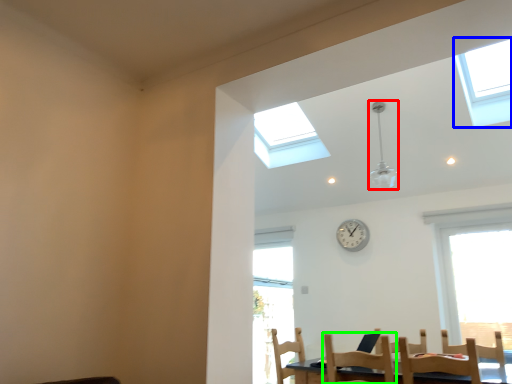
Question: Estimate the real-world distances between objects in this image. Which object is closer to light fixture (highlighted by a red box), window (highlighted by a blue box) or chair (highlighted by a green box)?

Choices:
 (A) window
 (B) chair

Answer: (A)